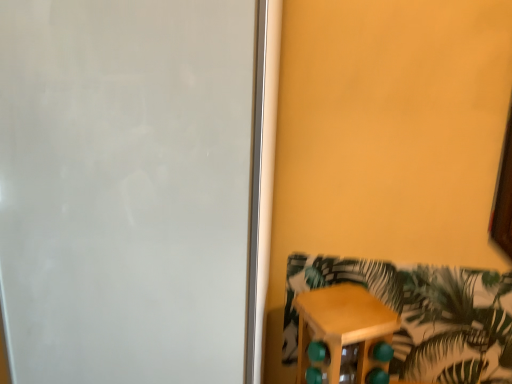
Question: In the image, is wooden stool at lower right positioned in front of or behind white matte screen door at left?

Choices:
 (A) behind
 (B) front

Answer: (A)

Question: From their relative heights in the image, would you say wooden stool at lower right is taller or shorter than white matte screen door at left?

Choices:
 (A) tall
 (B) short

Answer: (B)

Question: From a real-world perspective, relative to white matte screen door at left, is wooden stool at lower right vertically above or below?

Choices:
 (A) below
 (B) above

Answer: (A)

Question: From a real-world perspective, is white matte screen door at left physically located above or below wooden stool at lower right?

Choices:
 (A) below
 (B) above

Answer: (B)

Question: From their relative heights in the image, would you say white matte screen door at left is taller or shorter than wooden stool at lower right?

Choices:
 (A) tall
 (B) short

Answer: (A)

Question: Considering their positions, is white matte screen door at left located in front of or behind wooden stool at lower right?

Choices:
 (A) front
 (B) behind

Answer: (A)

Question: Considering the positions of white matte screen door at left and wooden stool at lower right in the image, is white matte screen door at left wider or thinner than wooden stool at lower right?

Choices:
 (A) thin
 (B) wide

Answer: (B)